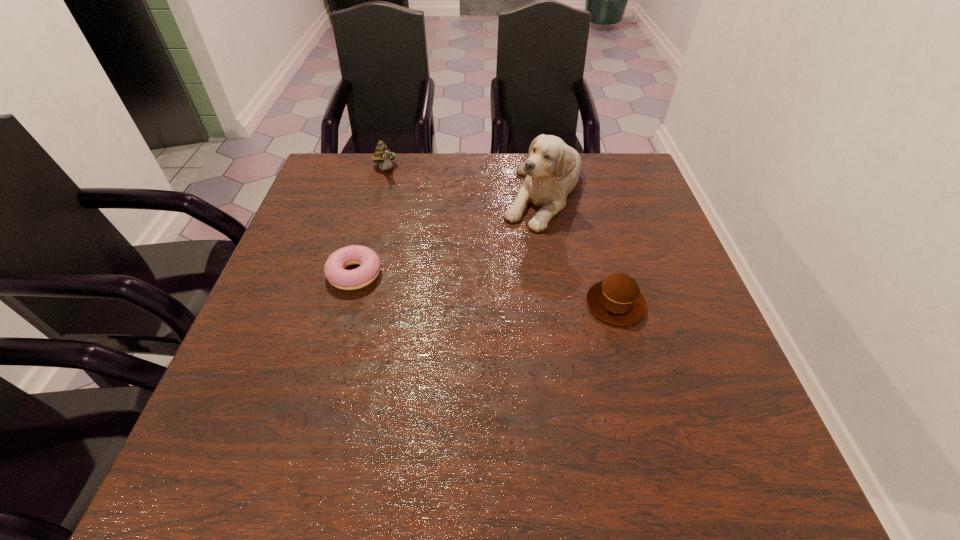
You are a GUI agent. You are given a task and a screenshot of the screen. Output one action in this format:
    pyautogui.click(x=<x>, y=<y>)
    Task: Click on the free region located 0.360m on the face of the third shortest object
    The width and height of the screenshot is (960, 540).
    Given the screenshot: What is the action you would take?
    pyautogui.click(x=427, y=260)

Where is `vacant area situated 0.090m on the face of the third shortest object`? The height and width of the screenshot is (540, 960). vacant area situated 0.090m on the face of the third shortest object is located at coordinates (396, 197).

Identify the location of puppy present at the far edge. Image resolution: width=960 pixels, height=540 pixels. (552, 169).

Where is `snail that is at the far edge`? snail that is at the far edge is located at coordinates (383, 155).

The image size is (960, 540). In order to click on doughnut that is at the left edge in this screenshot , I will do `click(334, 269)`.

This screenshot has width=960, height=540. Identify the location of snail located in the left edge section of the desktop. (383, 155).

Image resolution: width=960 pixels, height=540 pixels. I want to click on object situated at the right edge, so click(x=617, y=300).

Where is `object that is positioned at the far left corner`? object that is positioned at the far left corner is located at coordinates (383, 155).

Locate an element on the screen. vacant region at the far edge of the desktop is located at coordinates (460, 166).

The width and height of the screenshot is (960, 540). Identify the location of vacant position at the near edge of the desktop. (392, 416).